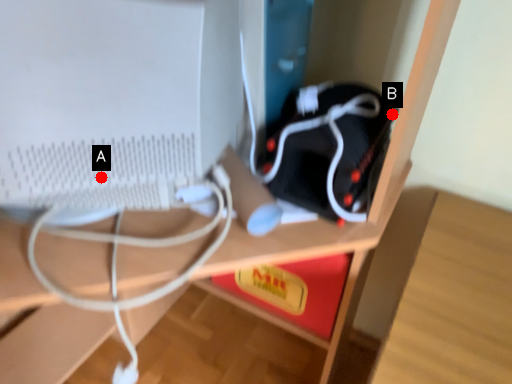
Question: Two points are circled on the image, labeled by A and B beside each circle. Which point is farther from the camera taking this photo?

Choices:
 (A) A is further
 (B) B is further

Answer: (B)